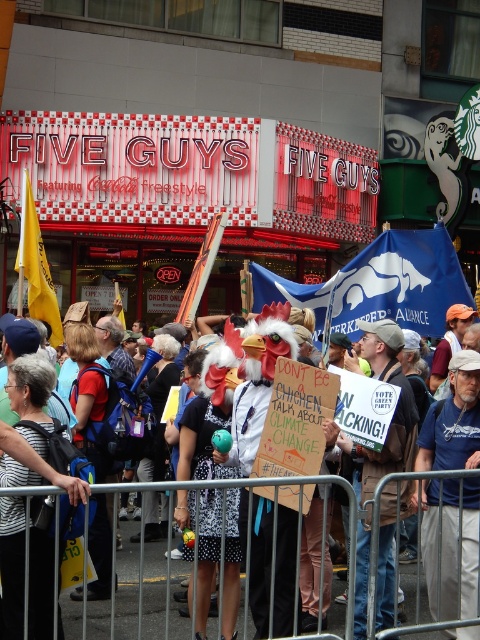
Is white polka dot dress at center thinner than blue cotton t-shirt at center?

No.

Does point (423, 472) lie in front of point (428, 573)?

That is True.

This screenshot has height=640, width=480. Find the location of `white polka dot dress at center`. white polka dot dress at center is located at coordinates (249, 518).